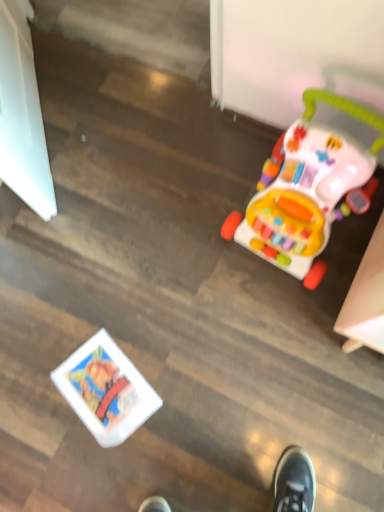
Find the location of a particular element. Image resolution: width=384 pixels, height=512 pixels. free space in front of white glossy book at lower left, which is the 2th toy from right to left is located at coordinates (122, 466).